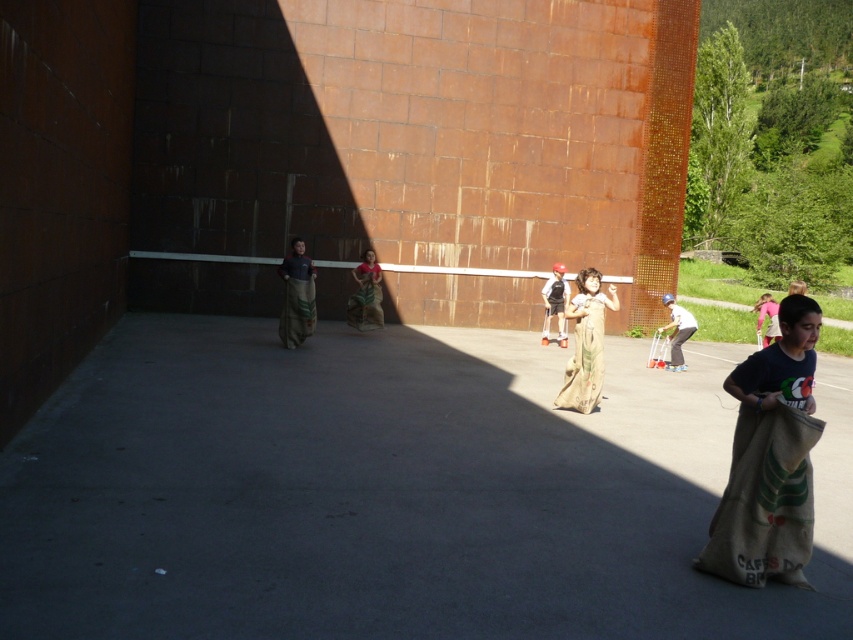
Is matte brown sack at center wider than pink fabric sack at right?

Yes.

Between matte brown sack at center and pink fabric sack at right, which one has more height?

matte brown sack at center

This screenshot has width=853, height=640. Find the location of `matte brown sack at center`. matte brown sack at center is located at coordinates (555, 304).

Can you confirm if matte brown sack at center is thinner than white cotton sack at center?

Yes, matte brown sack at center is thinner than white cotton sack at center.

Between matte brown sack at center and white cotton sack at center, which one is positioned higher?

Positioned higher is matte brown sack at center.

This screenshot has height=640, width=853. What do you see at coordinates (555, 304) in the screenshot? I see `matte brown sack at center` at bounding box center [555, 304].

I want to click on matte brown sack at center, so click(555, 304).

Can you confirm if brown burlap sack at center is positioned to the right of pink fabric sack at right?

In fact, brown burlap sack at center is to the left of pink fabric sack at right.

Who is more forward, (374,323) or (757,305)?

Positioned in front is point (757,305).

Identify the location of brown burlap sack at center. (366, 294).